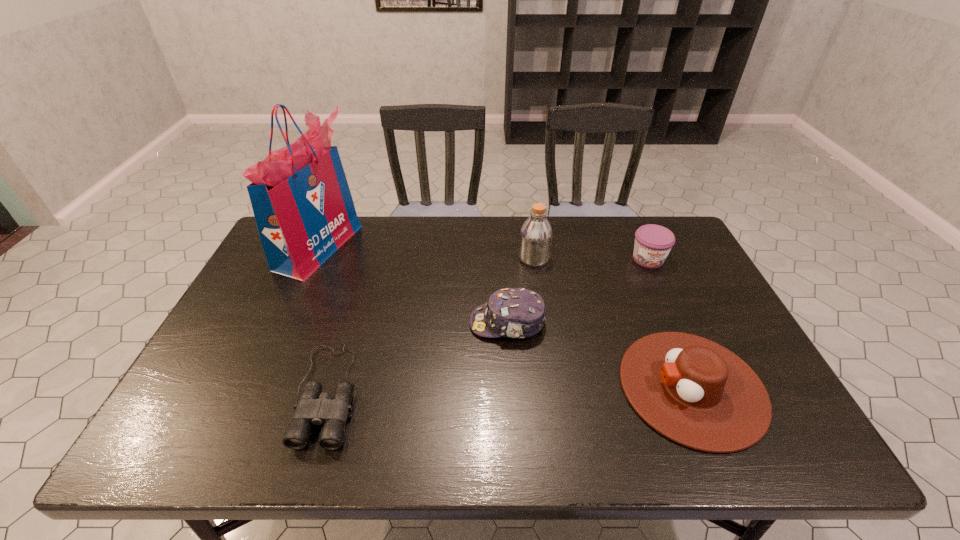
Find the location of `vacant area situated on the front-facing side of the headwear`. vacant area situated on the front-facing side of the headwear is located at coordinates (407, 323).

Where is `vacant region located 0.070m on the front-facing side of the headwear`? vacant region located 0.070m on the front-facing side of the headwear is located at coordinates (444, 323).

What are the coordinates of `free space located on the front-facing side of the cowboy hat` in the screenshot? It's located at (477, 387).

Identify the location of vacant area situated on the front-facing side of the cowboy hat. This screenshot has width=960, height=540. (477, 387).

The width and height of the screenshot is (960, 540). Identify the location of vacant space located on the front-facing side of the cowboy hat. (588, 387).

Locate an element on the screen. Image resolution: width=960 pixels, height=540 pixels. grocery bag present at the far edge is located at coordinates (304, 211).

You are a GUI agent. You are given a task and a screenshot of the screen. Output one action in this format:
    pyautogui.click(x=<x>, y=<y>)
    Task: Click on the bottle positioned at the far edge
    
    Given the screenshot: What is the action you would take?
    pyautogui.click(x=536, y=235)

This screenshot has width=960, height=540. Find the location of `jam that is at the far edge`. jam that is at the far edge is located at coordinates [653, 243].

Locate an element on the screen. Image resolution: width=960 pixels, height=540 pixels. cowboy hat that is at the near edge is located at coordinates (697, 393).

Identify the location of binoculars that is at the near edge. (314, 407).